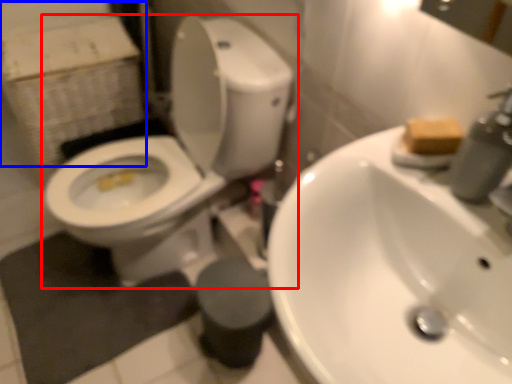
Question: Which of the following is the farthest to the observer, toilet (highlighted by a red box) or cardboard box (highlighted by a blue box)?

Choices:
 (A) toilet
 (B) cardboard box

Answer: (B)